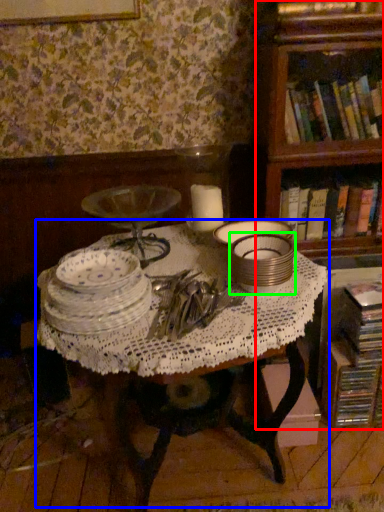
Question: Which object is positioned closest to bookcase (highlighted by a red box)? Select from table (highlighted by a blue box) and tableware (highlighted by a green box).

Choices:
 (A) table
 (B) tableware

Answer: (B)